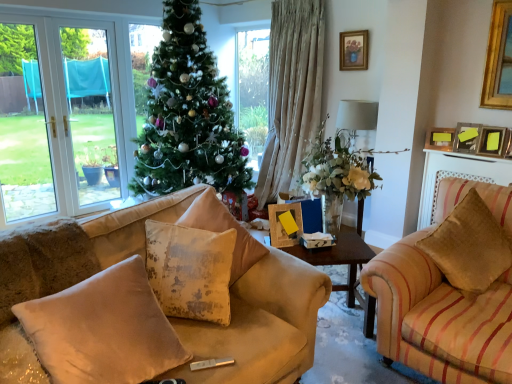
What do you see at coordinates (224, 230) in the screenshot?
I see `distressed beige pillow at center, the 2th pillow from the right` at bounding box center [224, 230].

What are the coordinates of `green matte christmas tree at center` in the screenshot? It's located at click(x=188, y=115).

The width and height of the screenshot is (512, 384). What do you see at coordinates (339, 257) in the screenshot?
I see `wooden table at center` at bounding box center [339, 257].

The width and height of the screenshot is (512, 384). Describe the element at coordinates (493, 141) in the screenshot. I see `wooden picture frame at upper right, marked as the fourth picture frame in a back-to-front arrangement` at that location.

At what (x,y) coordinates should I click in order to perform the action: click on wooden picture frame at upper right, marked as the fourth picture frame in a back-to-front arrangement. Please return your answer as a coordinate pair (x, y). Looking at the image, I should click on (493, 141).

In the scene shown: In order to face transparent glass lamp at center, should I rotate leftwards or rightwards?

Turn right approximately 12.963 degrees to face it.

This screenshot has width=512, height=384. Identify the location of distressed beige pillow at center, the 2th pillow from the right. (224, 230).

Is point (209, 84) positioned after point (437, 140)?

Yes, it is behind point (437, 140).

Can we say green matte christmas tree at center lies outside wooden picture frame at upper right, positioned as the 3th picture frame in right-to-left order?

Absolutely, green matte christmas tree at center is external to wooden picture frame at upper right, positioned as the 3th picture frame in right-to-left order.

Does green matte christmas tree at center appear on the left side of wooden picture frame at upper right, placed as the second picture frame when sorted from back to front?

Yes, green matte christmas tree at center is to the left of wooden picture frame at upper right, placed as the second picture frame when sorted from back to front.

Is gold-framed picture at upper center, which ranks as the first picture frame in left-to-right order, directly adjacent to wooden table at center?

gold-framed picture at upper center, which ranks as the first picture frame in left-to-right order, and wooden table at center are clearly separated.

From a real-world perspective, is gold-framed picture at upper center, arranged as the 1th picture frame when viewed from the top, located higher than wooden table at center?

Correct, in the physical world, gold-framed picture at upper center, arranged as the 1th picture frame when viewed from the top, is higher than wooden table at center.

Which point is more distant from viewer, (362, 62) or (345, 249)?

Point (362, 62)

Is wooden picture frame at upper right, the third picture frame in the bottom-to-top sequence, oriented away from distressed beige pillow at center, the third pillow when ordered from left to right?

No.

From the image's perspective, does wooden picture frame at upper right, which appears as the 2th picture frame when viewed from the top, appear lower than distressed beige pillow at center, the 2th pillow from the right?

No.

Is wooden picture frame at upper right, the 3th picture frame positioned from the front, thinner than distressed beige pillow at center, the third pillow when ordered from left to right?

Yes.

Is point (434, 130) positioned before point (253, 247)?

No, (434, 130) is behind (253, 247).

Does wooden table at center appear on the left side of distressed beige pillow at center, the third pillow when ordered from left to right?

No, wooden table at center is not to the left of distressed beige pillow at center, the third pillow when ordered from left to right.

From the picture: From the image's perspective, does wooden table at center appear lower than distressed beige pillow at center, the third pillow when ordered from left to right?

Indeed, from the image's perspective, wooden table at center is shown beneath distressed beige pillow at center, the third pillow when ordered from left to right.

Is wooden table at center placed right next to distressed beige pillow at center, the 2th pillow from the right?

No, wooden table at center is not making contact with distressed beige pillow at center, the 2th pillow from the right.

Looking at this image, is wooden table at center wider or thinner than distressed beige pillow at center, the 2th pillow from the right?

wooden table at center is wider than distressed beige pillow at center, the 2th pillow from the right.

Does transparent glass lamp at center appear on the right side of distressed beige pillow at center, the third pillow when ordered from left to right?

Yes.

Who is taller, transparent glass lamp at center or distressed beige pillow at center, the 2th pillow from the right?

Standing taller between the two is transparent glass lamp at center.

Measure the distance from transparent glass lamp at center to distressed beige pillow at center, the third pillow when ordered from left to right.

transparent glass lamp at center is 2.18 meters from distressed beige pillow at center, the third pillow when ordered from left to right.

Does transparent glass lamp at center turn towards distressed beige pillow at center, the 2th pillow from the right?

Yes, transparent glass lamp at center is aimed at distressed beige pillow at center, the 2th pillow from the right.

How far apart are transparent glass lamp at center and gold-framed picture at upper center, which is the 4th picture frame in front-to-back order?

They are 16.78 inches apart.

Is point (357, 118) positioned in front of point (353, 65)?

No, (357, 118) is behind (353, 65).

Is transparent glass lamp at center aimed at gold-framed picture at upper center, which is the 4th picture frame in front-to-back order?

No, transparent glass lamp at center is not oriented towards gold-framed picture at upper center, which is the 4th picture frame in front-to-back order.

Would you say transparent glass lamp at center is a long distance from gold-framed picture at upper center, placed as the 1th picture frame when sorted from back to front?

transparent glass lamp at center is near gold-framed picture at upper center, placed as the 1th picture frame when sorted from back to front, not far away.

Is beige velvet pillow at lower left, arranged as the fourth pillow when viewed from the right, oriented away from transparent glass lamp at center?

beige velvet pillow at lower left, arranged as the fourth pillow when viewed from the right, is not turned away from transparent glass lamp at center.

From the image's perspective, starting from the transparent glass lamp at center, which pillow is the 4th one below? Please provide its 2D coordinates.

[(103, 329)]

Is beige velvet pillow at lower left, the 1th pillow in the left-to-right sequence, directly adjacent to transparent glass lamp at center?

No, beige velvet pillow at lower left, the 1th pillow in the left-to-right sequence, is not touching transparent glass lamp at center.

There is a wooden picture frame at upper right, which appears as the 2th picture frame when viewed from the top. Where is `christmas tree above it (from a real-world perspective)`? christmas tree above it (from a real-world perspective) is located at coordinates (188, 115).

Where is `table beneath the gold-framed picture at upper center, the 4th picture frame in the bottom-to-top sequence (from a real-world perspective)`? table beneath the gold-framed picture at upper center, the 4th picture frame in the bottom-to-top sequence (from a real-world perspective) is located at coordinates (339, 257).

Estimate the real-world distances between objects in this image. Which object is further from translucent glass vase at center, beige velvet pillow at lower left, the 1th pillow in the left-to-right sequence, or distressed beige pillow at center, the 2th pillow from the right?

The object further to translucent glass vase at center is beige velvet pillow at lower left, the 1th pillow in the left-to-right sequence.

Estimate the real-world distances between objects in this image. Which object is closer to translucent glass vase at center, wooden picture frame at upper right, which appears as the second picture frame when viewed from the front, or washed velvet cushion at center, the 3th pillow in the right-to-left sequence?

washed velvet cushion at center, the 3th pillow in the right-to-left sequence, is positioned closer to the anchor translucent glass vase at center.

When comparing their distances from transparent glass lamp at center, does translucent glass vase at center or beige velvet pillow at lower left, arranged as the fourth pillow when viewed from the right, seem closer?

The object closer to transparent glass lamp at center is translucent glass vase at center.

From the image, which object appears to be farther from wooden table at center, wooden picture frame at upper right, the 3th picture frame viewed from the back, or wooden picture frame at upper right, the 1th picture frame in the bottom-to-top sequence?

wooden picture frame at upper right, the 1th picture frame in the bottom-to-top sequence, is further to wooden table at center.

Looking at the image, which one is located closer to wooden picture frame at upper right, which appears as the 2th picture frame when viewed from the top, washed velvet cushion at center, the 3th pillow in the right-to-left sequence, or wooden table at center?

wooden table at center is closer to wooden picture frame at upper right, which appears as the 2th picture frame when viewed from the top.

Considering their positions, is wooden picture frame at upper right, the second picture frame when ordered from right to left, positioned closer to beige velvet pillow at lower left, arranged as the fourth pillow when viewed from the right, than wooden picture frame at upper right, which is the 4th picture frame from top to bottom?

wooden picture frame at upper right, the second picture frame when ordered from right to left, lies closer to beige velvet pillow at lower left, arranged as the fourth pillow when viewed from the right, than the other object.

Estimate the real-world distances between objects in this image. Which object is closer to velvet beige pillow at right, placed as the fourth pillow when sorted from left to right, translucent glass vase at center or transparent glass lamp at center?

translucent glass vase at center.

Estimate the real-world distances between objects in this image. Which object is further from velvet beige pillow at right, placed as the fourth pillow when sorted from left to right, beige velvet pillow at lower left, the 1th pillow in the left-to-right sequence, or washed velvet cushion at center, the 3th pillow in the right-to-left sequence?

beige velvet pillow at lower left, the 1th pillow in the left-to-right sequence.

You are a GUI agent. You are given a task and a screenshot of the screen. Output one action in this format:
    pyautogui.click(x=<x>, y=<y>)
    Task: Click on the table between beige velvet pillow at lower left, arranged as the fourth pillow when viewed from the right, and wooden picture frame at upper right, which appears as the 2th picture frame when viewed from the top, along the z-axis
    The width and height of the screenshot is (512, 384).
    Given the screenshot: What is the action you would take?
    pyautogui.click(x=339, y=257)

The height and width of the screenshot is (384, 512). Find the location of `houseplant between beige velvet pillow at lower left, the 1th pillow in the left-to-right sequence, and wooden picture frame at upper right, which appears as the 2th picture frame when ordered from the bottom, from left to right`. houseplant between beige velvet pillow at lower left, the 1th pillow in the left-to-right sequence, and wooden picture frame at upper right, which appears as the 2th picture frame when ordered from the bottom, from left to right is located at coordinates (337, 166).

At what (x,y) coordinates should I click in order to perform the action: click on table between green matte christmas tree at center and transparent glass lamp at center in the horizontal direction. Please return your answer as a coordinate pair (x, y). Looking at the image, I should click on (339, 257).

Identify the location of christmas tree located between distressed beige pillow at center, the third pillow when ordered from left to right, and gold-framed picture at upper center, the 4th picture frame when ordered from right to left, in the depth direction. (188, 115).